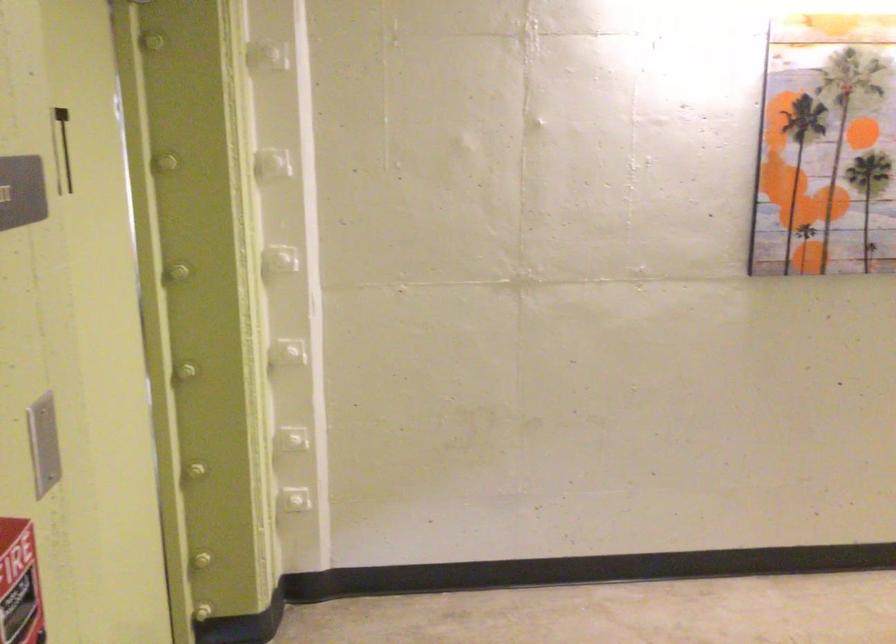
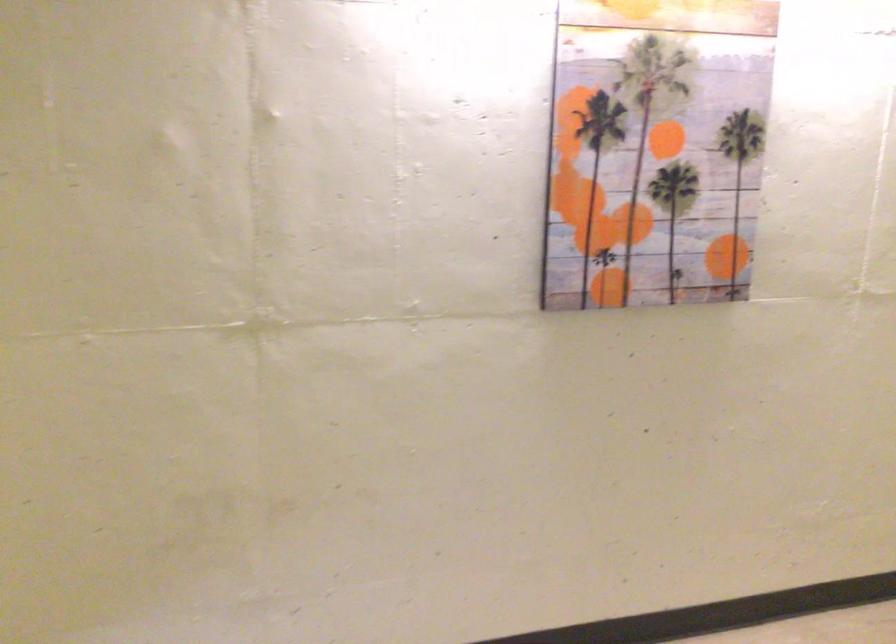
Question: The camera is either moving clockwise (left) or counter-clockwise (right) around the object. The first image is from the beginning of the video and the second image is from the end. Is the camera moving left or right when shooting the video?

Choices:
 (A) Left
 (B) Right

Answer: (A)